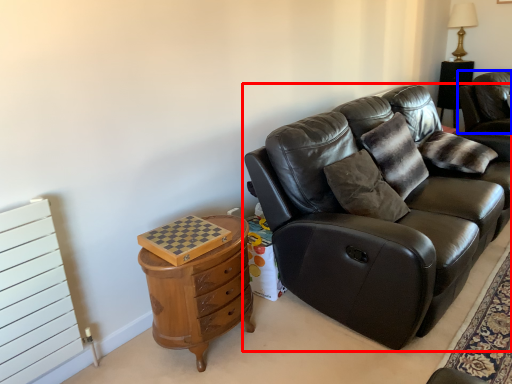
Question: Among these objects, which one is nearest to the camera, studio couch (highlighted by a red box) or chair (highlighted by a blue box)?

Choices:
 (A) studio couch
 (B) chair

Answer: (A)